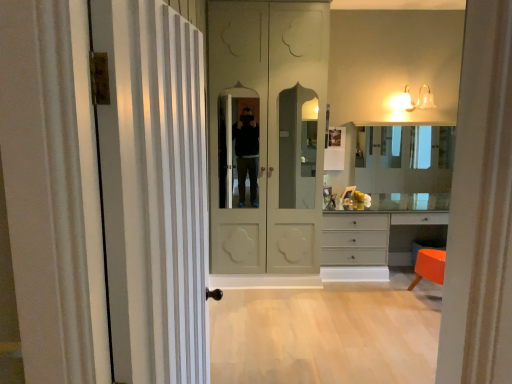
Question: Considering the relative positions of matte white bell-shaped light fixture at upper right and matte cream door at center, which is the first door in back-to-front order, in the image provided, is matte white bell-shaped light fixture at upper right to the left of matte cream door at center, which is the first door in back-to-front order, from the viewer's perspective?

Choices:
 (A) no
 (B) yes

Answer: (A)

Question: Is matte white bell-shaped light fixture at upper right outside of matte cream door at center, which appears as the second door when viewed from the front?

Choices:
 (A) no
 (B) yes

Answer: (B)

Question: Can you confirm if matte white bell-shaped light fixture at upper right is positioned to the right of matte cream door at center, which appears as the second door when viewed from the front?

Choices:
 (A) no
 (B) yes

Answer: (B)

Question: Is matte white bell-shaped light fixture at upper right not near matte cream door at center, which appears as the second door when viewed from the front?

Choices:
 (A) no
 (B) yes

Answer: (B)

Question: Is matte white bell-shaped light fixture at upper right bigger than matte cream door at center, which is the first door in back-to-front order?

Choices:
 (A) yes
 (B) no

Answer: (B)

Question: Does matte white bell-shaped light fixture at upper right have a lesser height compared to matte cream door at center, which is the first door in back-to-front order?

Choices:
 (A) yes
 (B) no

Answer: (A)

Question: Does white striped door at left, which is counted as the 1th door, starting from the front, appear on the right side of matte gray dresser at lower right?

Choices:
 (A) yes
 (B) no

Answer: (B)

Question: Can you confirm if white striped door at left, the 2th door positioned from the back, is shorter than matte gray dresser at lower right?

Choices:
 (A) yes
 (B) no

Answer: (B)

Question: Is white striped door at left, the 2th door positioned from the back, facing towards matte gray dresser at lower right?

Choices:
 (A) yes
 (B) no

Answer: (B)

Question: From a real-world perspective, does white striped door at left, the 2th door positioned from the back, stand above matte gray dresser at lower right?

Choices:
 (A) no
 (B) yes

Answer: (B)

Question: From the image's perspective, is white striped door at left, which is counted as the 1th door, starting from the front, located above matte gray dresser at lower right?

Choices:
 (A) no
 (B) yes

Answer: (B)

Question: Can you see white striped door at left, which is counted as the 1th door, starting from the front, touching matte gray dresser at lower right?

Choices:
 (A) no
 (B) yes

Answer: (A)

Question: Is matte white bell-shaped light fixture at upper right shorter than light wood floor at lower center?

Choices:
 (A) yes
 (B) no

Answer: (B)